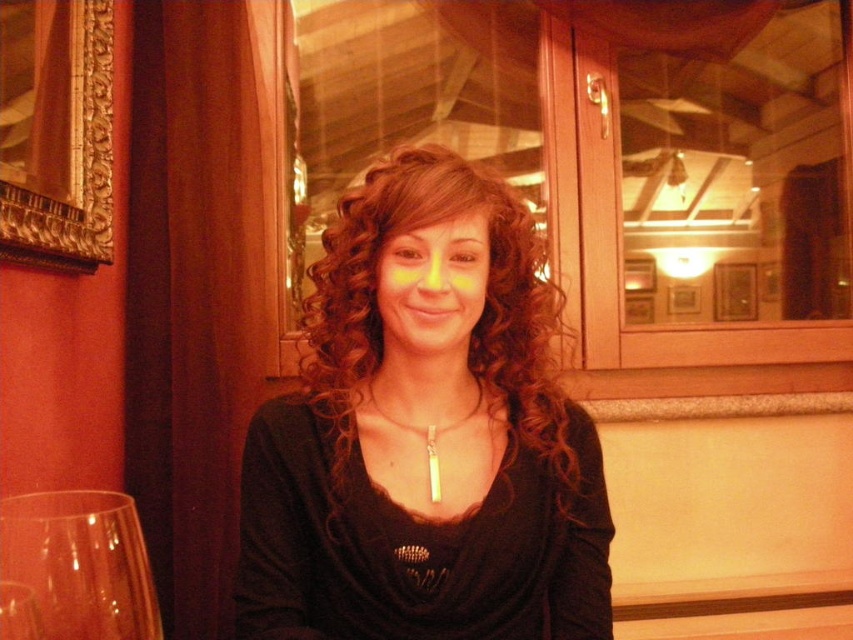
Question: Does matte black shirt at center have a lesser width compared to transparent glass at lower left?

Choices:
 (A) no
 (B) yes

Answer: (A)

Question: Does matte black shirt at center appear over transparent glass at lower left?

Choices:
 (A) no
 (B) yes

Answer: (B)

Question: Which point is farther from the camera taking this photo?

Choices:
 (A) (270, 529)
 (B) (91, 500)

Answer: (B)

Question: Does matte black shirt at center have a larger size compared to transparent glass at lower left?

Choices:
 (A) yes
 (B) no

Answer: (A)

Question: Among these points, which one is nearest to the camera?

Choices:
 (A) (90, 541)
 (B) (476, 284)

Answer: (A)